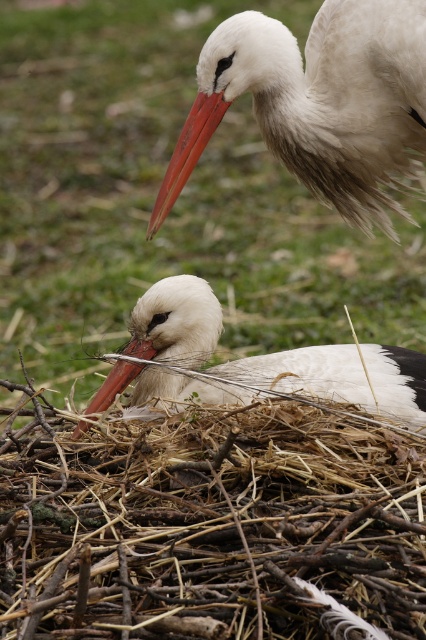
You are a wildlife photographer observing the two storks in their nest. You need to determine which object is bigger between the white matte bird at center and the matte orange beak at center. Which one is larger?

The white matte bird at center is larger in size than the matte orange beak at center.

You are a birdwatcher observing the two storks in their nest. You notice the brown straw nest at lower center and the matte orange beak at center. Which object occupies more space in the image?

The brown straw nest at lower center occupies more space in the image because it has a larger size compared to the matte orange beak at center.